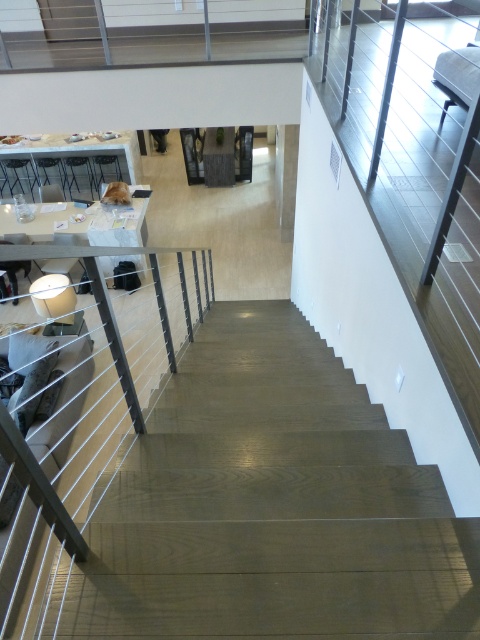
Question: Can you confirm if wooden stairs at center is wider than white glossy table at upper left?

Choices:
 (A) no
 (B) yes

Answer: (A)

Question: Does wooden stairs at center appear on the left side of dark brown leather jacket at upper center?

Choices:
 (A) yes
 (B) no

Answer: (B)

Question: Which of the following is the closest to the observer?

Choices:
 (A) white glossy table at upper left
 (B) white glossy table at upper center

Answer: (B)

Question: Can you confirm if white glossy table at upper left is smaller than white glossy table at upper center?

Choices:
 (A) yes
 (B) no

Answer: (B)

Question: Which object is the farthest from the dark brown leather jacket at upper center?

Choices:
 (A) white glossy table at upper center
 (B) white glossy table at upper left
 (C) wooden stairs at center

Answer: (C)

Question: Which of the following is the closest to the observer?

Choices:
 (A) white glossy table at upper left
 (B) white glossy table at upper center
 (C) wooden stairs at center
 (D) dark brown leather jacket at upper center

Answer: (C)